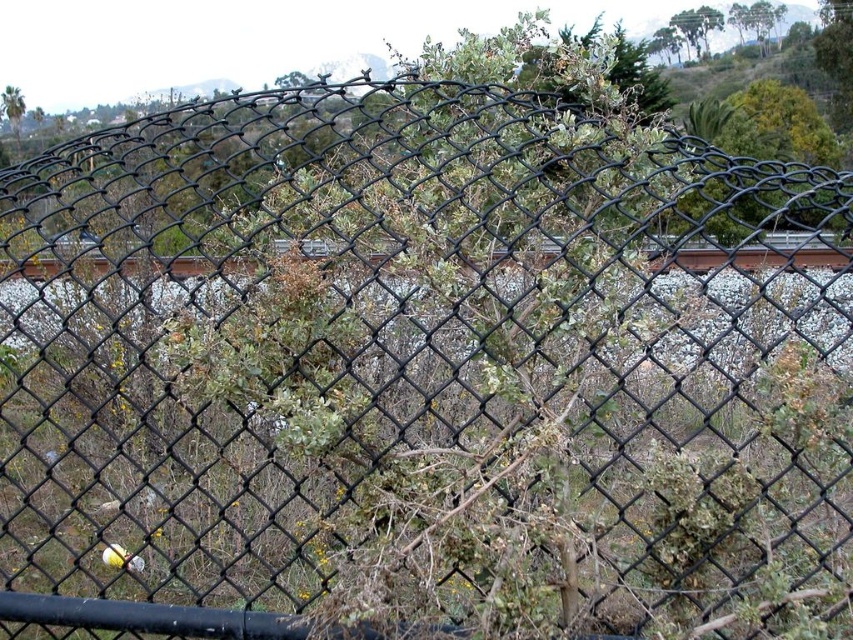
Is point (177, 269) closer to camera compared to point (16, 97)?

Yes, point (177, 269) is in front of point (16, 97).

Is brown wooden train track at center wider than green leafy tree at upper left?

Yes.

What do you see at coordinates (119, 266) in the screenshot? I see `brown wooden train track at center` at bounding box center [119, 266].

The width and height of the screenshot is (853, 640). I want to click on brown wooden train track at center, so click(119, 266).